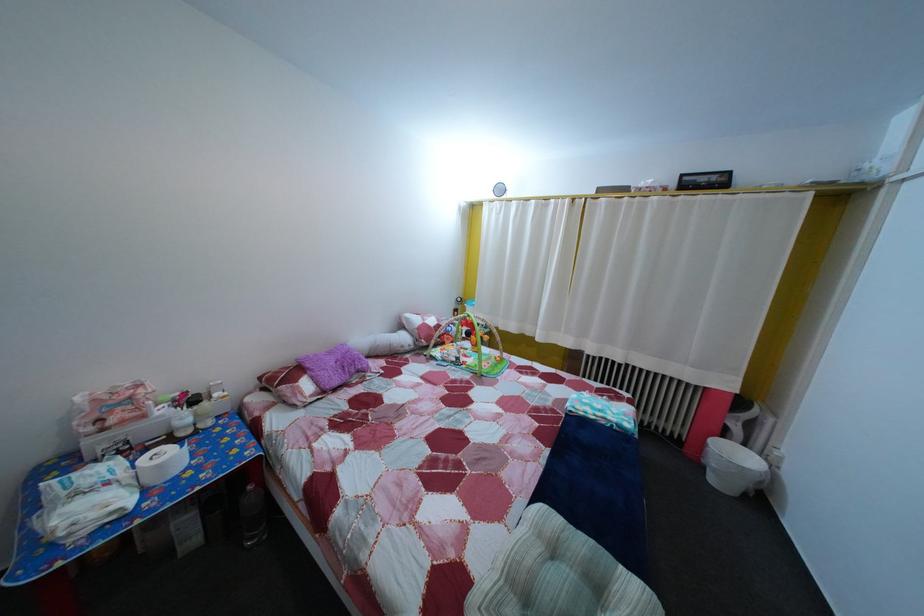
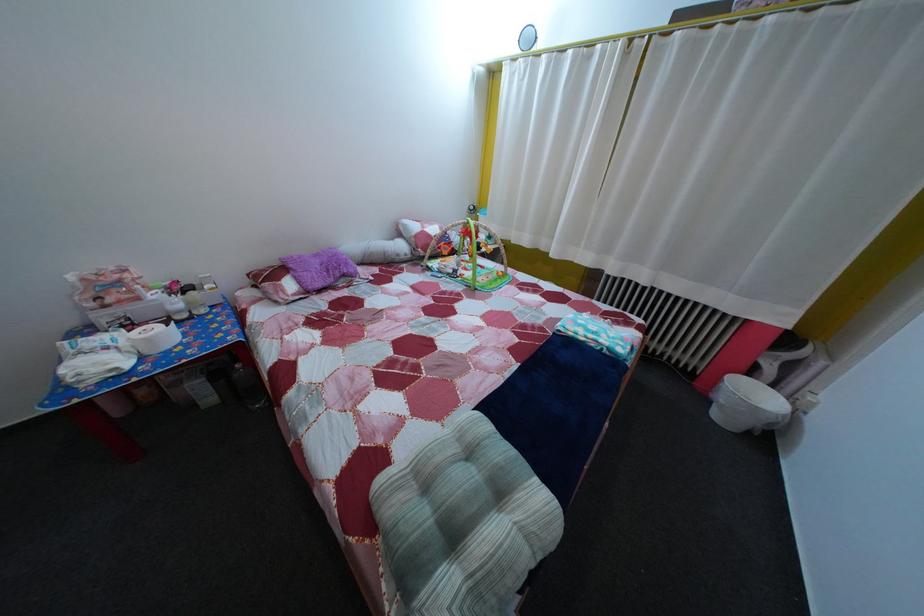
The point at (505,533) is marked in the first image. Where is the corresponding point in the second image?

(442, 432)